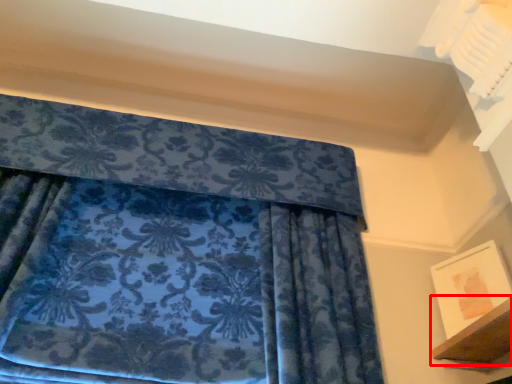
Question: Considering the relative positions of shelf (annotated by the red box) and picture frame in the image provided, where is shelf (annotated by the red box) located with respect to the staircase?

Choices:
 (A) left
 (B) right

Answer: (A)